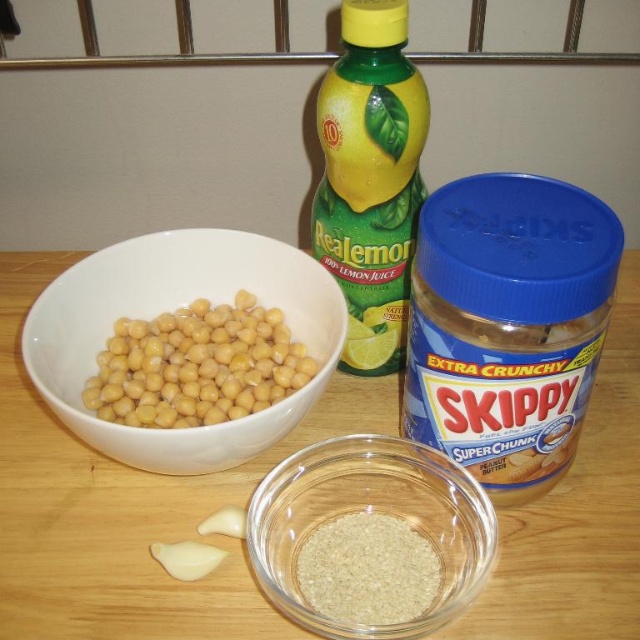
Which is more to the left, green plastic bottle at center or white granular rice at lower center?

Positioned to the left is green plastic bottle at center.

Who is higher up, green plastic bottle at center or white granular rice at lower center?

green plastic bottle at center is higher up.

Find the location of a particular element. The width and height of the screenshot is (640, 640). green plastic bottle at center is located at coordinates (371, 179).

Can you confirm if white ceramic bowl at left is smaller than white granular rice at lower center?

No, white ceramic bowl at left is not smaller than white granular rice at lower center.

Which of these two, white ceramic bowl at left or white granular rice at lower center, stands taller?

Standing taller between the two is white ceramic bowl at left.

I want to click on white ceramic bowl at left, so click(x=172, y=308).

Is transparent glass bowl at center positioned before white granular rice at lower center?

Yes, transparent glass bowl at center is closer to the viewer.

Does transparent glass bowl at center have a smaller size compared to white granular rice at lower center?

No.

Between point (348, 472) and point (392, 611), which one is positioned in front?

Point (392, 611)

Find the location of `transparent glass bowl at center`. transparent glass bowl at center is located at coordinates (372, 508).